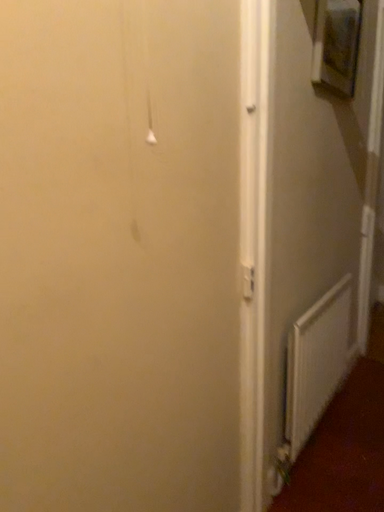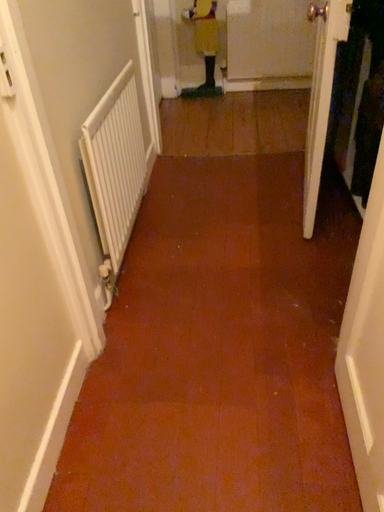
Question: Which way did the camera rotate in the video?

Choices:
 (A) rotated downward
 (B) rotated upward

Answer: (A)